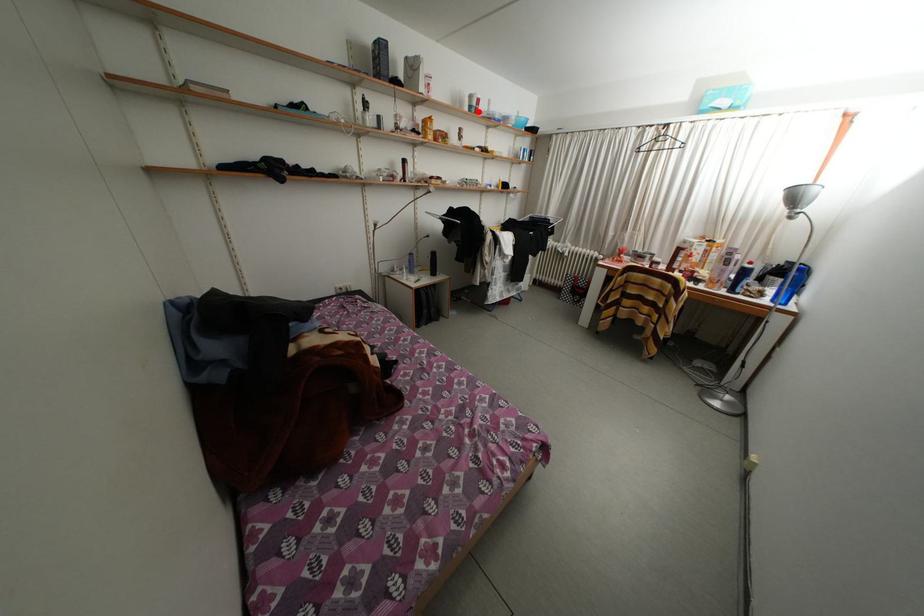
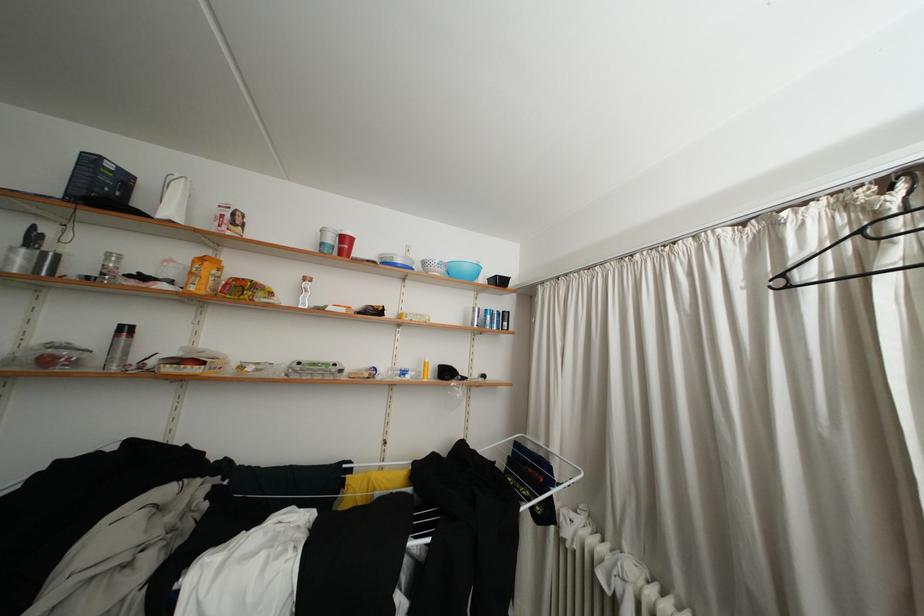
Question: I am providing you with two images of the same scene from different viewpoints. In image1, a red point is highlighted. Considering the same 3D point in image2, which of the following is correct?

Choices:
 (A) It is closer
 (B) It is farther

Answer: (B)